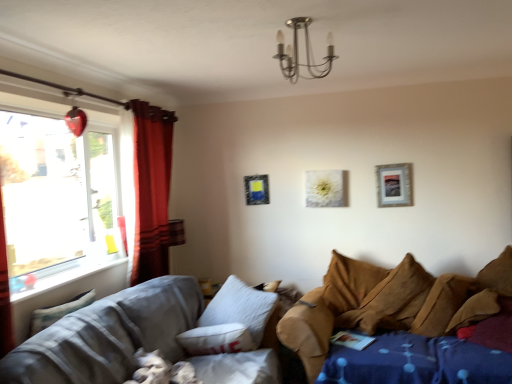
Question: Can we say brown fabric couch at lower right, which is the first studio couch in right-to-left order, lies outside textured gray fabric couch at lower left, which ranks as the 1th studio couch in left-to-right order?

Choices:
 (A) yes
 (B) no

Answer: (A)

Question: Considering the relative sizes of brown fabric couch at lower right, arranged as the 2th studio couch when viewed from the left, and textured gray fabric couch at lower left, which ranks as the 1th studio couch in left-to-right order, in the image provided, is brown fabric couch at lower right, arranged as the 2th studio couch when viewed from the left, wider than textured gray fabric couch at lower left, which ranks as the 1th studio couch in left-to-right order,?

Choices:
 (A) no
 (B) yes

Answer: (A)

Question: Does brown fabric couch at lower right, arranged as the 2th studio couch when viewed from the left, appear on the right side of textured gray fabric couch at lower left, which ranks as the 1th studio couch in left-to-right order?

Choices:
 (A) yes
 (B) no

Answer: (A)

Question: Considering the relative sizes of brown fabric couch at lower right, arranged as the 2th studio couch when viewed from the left, and textured gray fabric couch at lower left, which ranks as the 1th studio couch in left-to-right order, in the image provided, is brown fabric couch at lower right, arranged as the 2th studio couch when viewed from the left, shorter than textured gray fabric couch at lower left, which ranks as the 1th studio couch in left-to-right order,?

Choices:
 (A) yes
 (B) no

Answer: (A)

Question: Does brown fabric couch at lower right, arranged as the 2th studio couch when viewed from the left, touch textured gray fabric couch at lower left, which ranks as the 1th studio couch in left-to-right order?

Choices:
 (A) yes
 (B) no

Answer: (B)

Question: Is brown fabric couch at lower right, which is the first studio couch in right-to-left order, facing away from textured gray fabric couch at lower left, which ranks as the 1th studio couch in left-to-right order?

Choices:
 (A) no
 (B) yes

Answer: (A)

Question: Can you confirm if brown fabric couch at lower right, which is the first studio couch in right-to-left order, is positioned to the right of red velvet curtain at left?

Choices:
 (A) no
 (B) yes

Answer: (B)

Question: From a real-world perspective, is brown fabric couch at lower right, which is the first studio couch in right-to-left order, located beneath red velvet curtain at left?

Choices:
 (A) no
 (B) yes

Answer: (B)

Question: Considering the relative positions of brown fabric couch at lower right, which is the first studio couch in right-to-left order, and red velvet curtain at left in the image provided, is brown fabric couch at lower right, which is the first studio couch in right-to-left order, to the left of red velvet curtain at left from the viewer's perspective?

Choices:
 (A) no
 (B) yes

Answer: (A)

Question: Does brown fabric couch at lower right, which is the first studio couch in right-to-left order, have a greater height compared to red velvet curtain at left?

Choices:
 (A) no
 (B) yes

Answer: (A)

Question: Can you confirm if brown fabric couch at lower right, arranged as the 2th studio couch when viewed from the left, is thinner than red velvet curtain at left?

Choices:
 (A) no
 (B) yes

Answer: (A)

Question: Is brown fabric couch at lower right, which is the first studio couch in right-to-left order, aimed at red velvet curtain at left?

Choices:
 (A) yes
 (B) no

Answer: (B)

Question: Is fluffy white pillow at lower left, marked as the 2th pillow in a right-to-left arrangement, surrounding brown fabric couch at lower right, arranged as the 2th studio couch when viewed from the left?

Choices:
 (A) no
 (B) yes

Answer: (A)